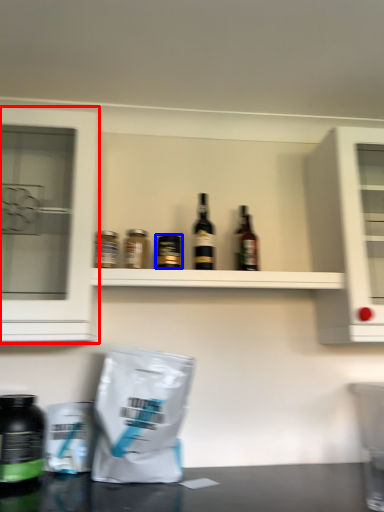
Question: Which object appears farthest to the camera in this image, cabinetry (highlighted by a red box) or bottle (highlighted by a blue box)?

Choices:
 (A) cabinetry
 (B) bottle

Answer: (B)